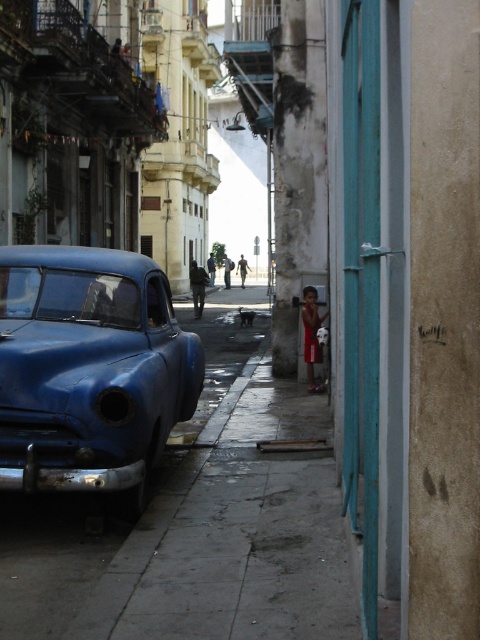
Is matte blue car at left smaller than red fabric shirt at lower right?

Actually, matte blue car at left might be larger than red fabric shirt at lower right.

Can you confirm if matte blue car at left is positioned to the left of red fabric shirt at lower right?

Correct, you'll find matte blue car at left to the left of red fabric shirt at lower right.

Who is more forward, (142, 472) or (312, 326)?

Positioned in front is point (142, 472).

Find the location of a particular element. Image resolution: width=480 pixels, height=640 pixels. matte blue car at left is located at coordinates (90, 371).